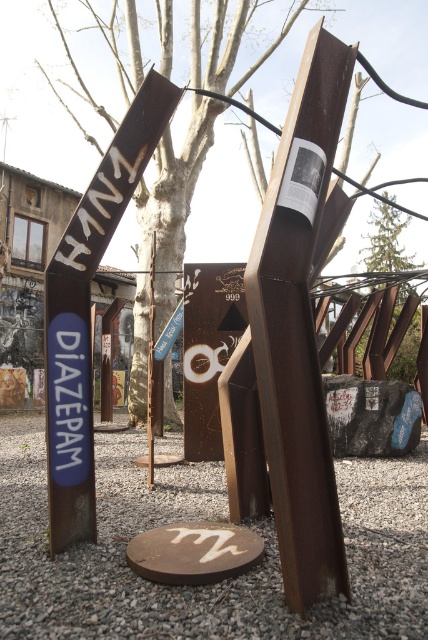
Question: Which point appears farthest from the camera in this image?

Choices:
 (A) (70, 484)
 (B) (249, 595)
 (C) (413, 264)
 (D) (181, 160)

Answer: (C)

Question: Is rusty gravel at center positioned behind rustic wood tree at center?

Choices:
 (A) yes
 (B) no

Answer: (B)

Question: Which point is farther from the camera taking this photo?

Choices:
 (A) (231, 64)
 (B) (76, 374)

Answer: (A)

Question: In this image, where is rusty gravel at center located relative to rustic wood tree at center?

Choices:
 (A) below
 (B) above

Answer: (A)

Question: Is rusty metal sign at left to the left of green leafy tree at upper center from the viewer's perspective?

Choices:
 (A) yes
 (B) no

Answer: (A)

Question: Estimate the real-world distances between objects in this image. Which object is farther from the rustic wood tree at center?

Choices:
 (A) rusty metal sign at left
 (B) rusty gravel at center

Answer: (B)